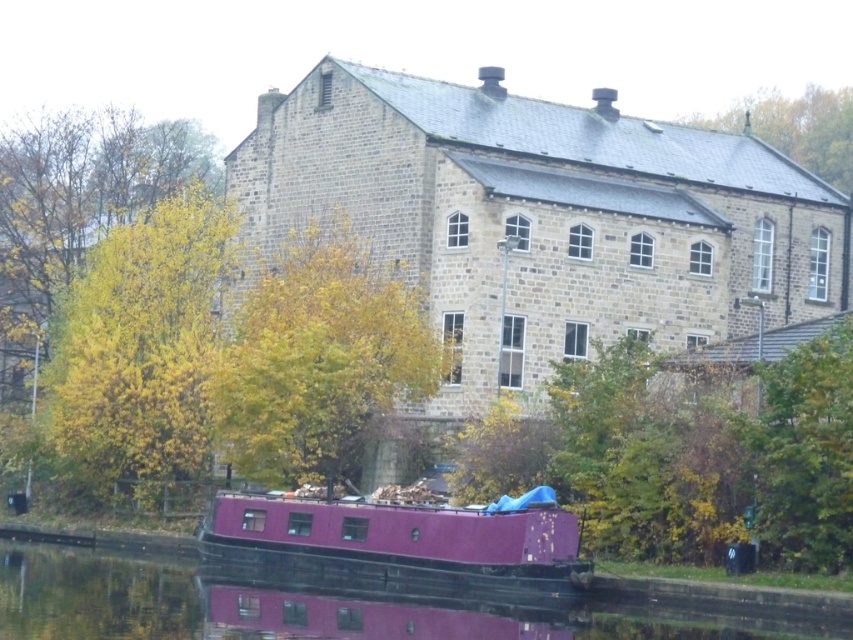
You are an artist planning to paint the riverside scene. You want to ensure the yellow leafy tree at left and the purple matte barge at lower center are proportionally accurate. Which object should you draw wider to maintain the correct proportions?

The purple matte barge at lower center should be drawn wider since it has a greater width than the yellow leafy tree at left according to the description.

You are an artist planning to paint the riverside scene. You want to ensure the yellow leafy tree at center and the green leafy tree at upper right are proportionally accurate. Which tree should you draw wider in your painting?

The green leafy tree at upper right should be drawn wider since its width is greater than the yellow leafy tree at center.

You are standing at the riverside and want to take a photo of the historic building. You notice two points marked on your map at coordinates point (x=236, y=381) and point (x=286, y=515). Which point is closer to you, the photographer?

Point (x=236, y=381) is further to the camera than point (x=286, y=515), so the point closer to you is point (x=286, y=515).